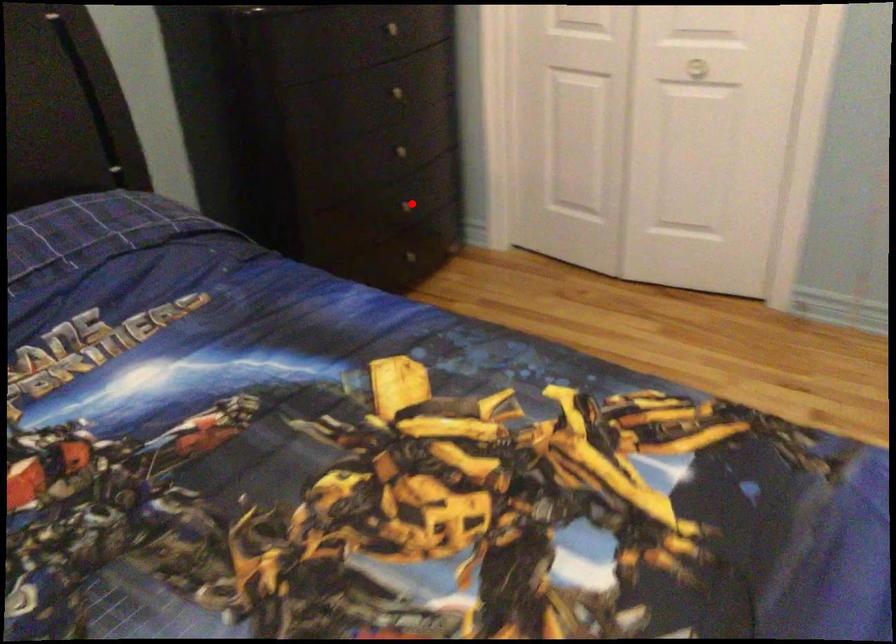
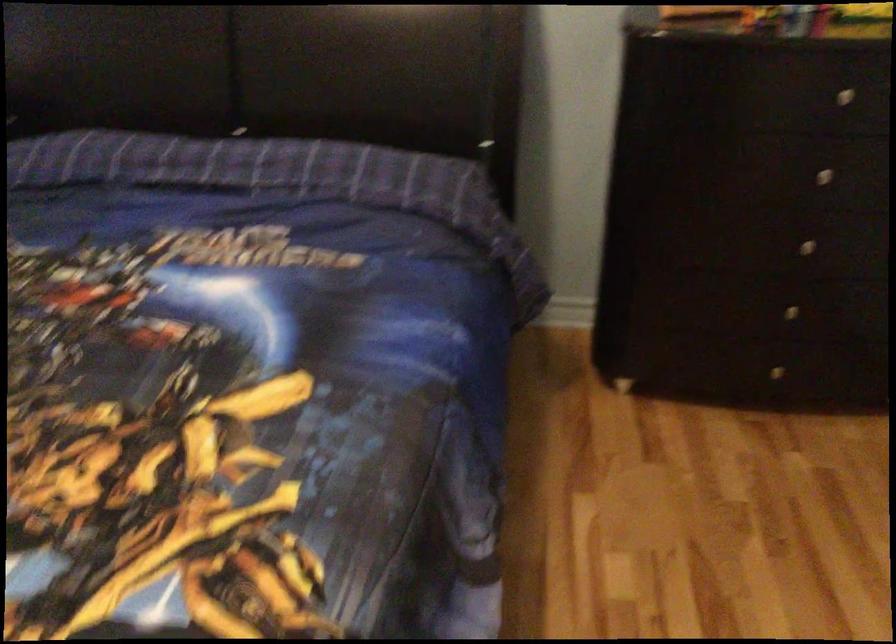
Question: I am providing you with two images of the same scene from different viewpoints. In image1, a red point is highlighted. Considering the same 3D point in image2, which of the following is correct?

Choices:
 (A) It is closer
 (B) It is farther

Answer: (A)